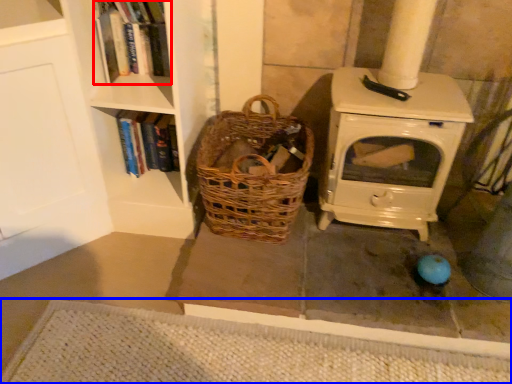
Question: Which object appears farthest to the camera in this image, book (highlighted by a red box) or doormat (highlighted by a blue box)?

Choices:
 (A) book
 (B) doormat

Answer: (A)